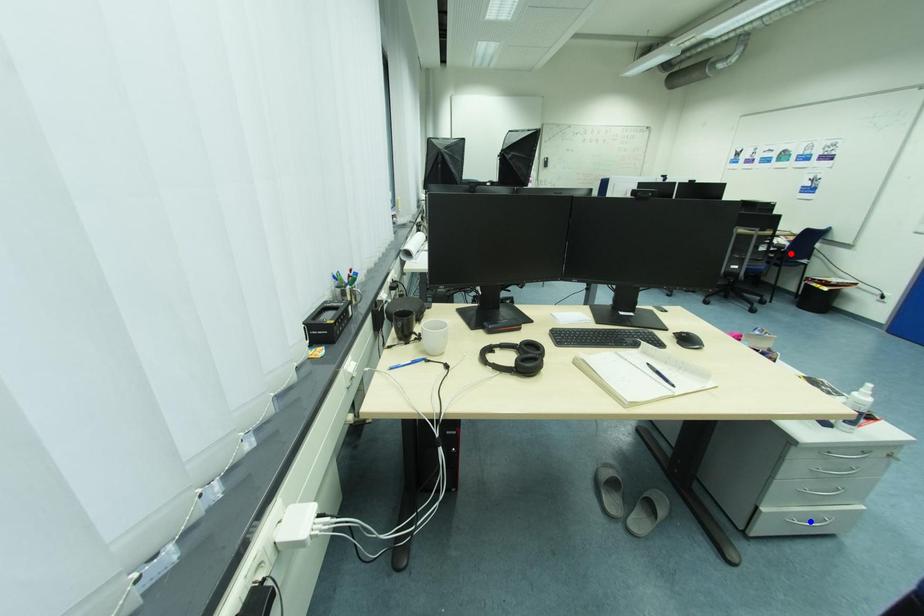
Question: Two points are marked on the image. Which point is closer to the camera?

Choices:
 (A) Blue point is closer.
 (B) Red point is closer.

Answer: (A)